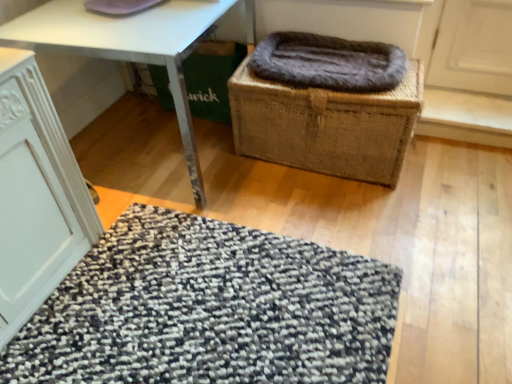
Find the location of `free location to the right of white matte cabinet at lower left`. free location to the right of white matte cabinet at lower left is located at coordinates (135, 278).